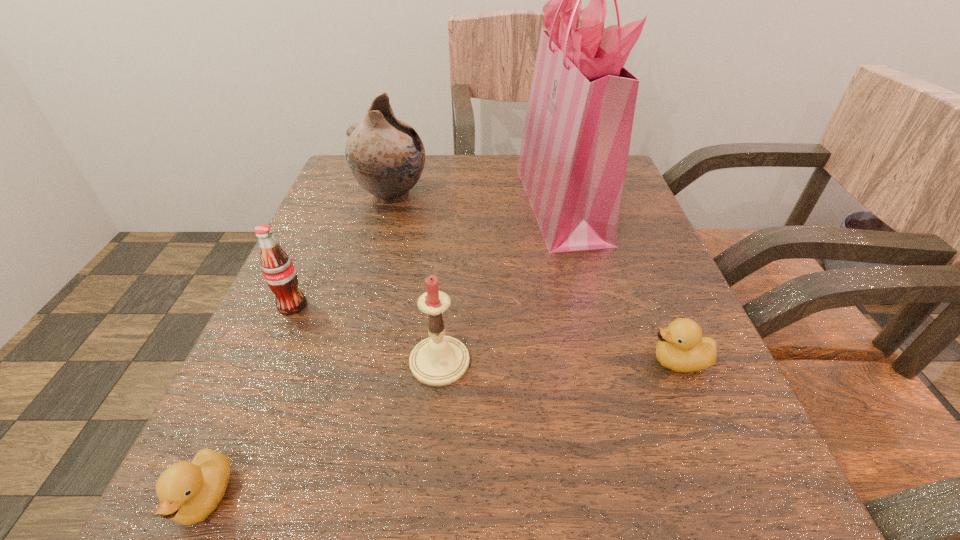
What are the coordinates of `shopping bag` in the screenshot? It's located at (573, 158).

Image resolution: width=960 pixels, height=540 pixels. I want to click on pottery, so click(385, 155).

Identify the location of the fifth shortest object. (385, 155).

At what (x,y) coordinates should I click in order to perform the action: click on the fourth object from left to right. Please return your answer as a coordinate pair (x, y). Looking at the image, I should click on (439, 360).

You are a GUI agent. You are given a task and a screenshot of the screen. Output one action in this format:
    pyautogui.click(x=<x>, y=<y>)
    Task: Click on the soda
    This screenshot has height=540, width=960.
    Given the screenshot: What is the action you would take?
    pyautogui.click(x=278, y=270)

You are a GUI agent. You are given a task and a screenshot of the screen. Output one action in this format:
    pyautogui.click(x=<x>, y=<y>)
    Task: Click on the farther duckling
    This screenshot has height=540, width=960.
    Given the screenshot: What is the action you would take?
    pyautogui.click(x=681, y=347)

Identify the location of the nearest object. Image resolution: width=960 pixels, height=540 pixels. (188, 492).

The height and width of the screenshot is (540, 960). Find the location of `the left duckling`. the left duckling is located at coordinates (188, 492).

Locate an element on the screen. Image resolution: width=960 pixels, height=540 pixels. free region located on the left of the tallest object is located at coordinates (412, 202).

Image resolution: width=960 pixels, height=540 pixels. Find the location of `free location located from the spout of the fifth shortest object`. free location located from the spout of the fifth shortest object is located at coordinates (611, 196).